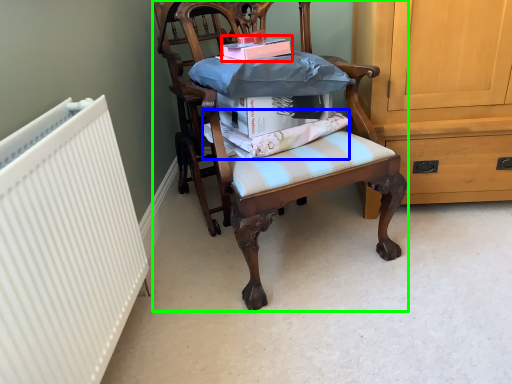
Question: Which is nearer to the book (highlighted by a red box)? fabric (highlighted by a blue box) or chair (highlighted by a green box).

Choices:
 (A) fabric
 (B) chair

Answer: (A)